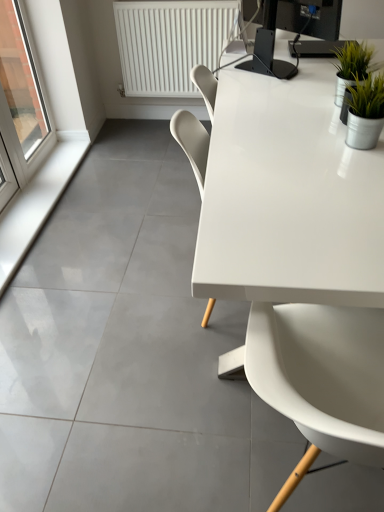
Locate an element on the screen. The height and width of the screenshot is (512, 384). vacant space to the left of green metallic pot at upper right is located at coordinates pos(292,101).